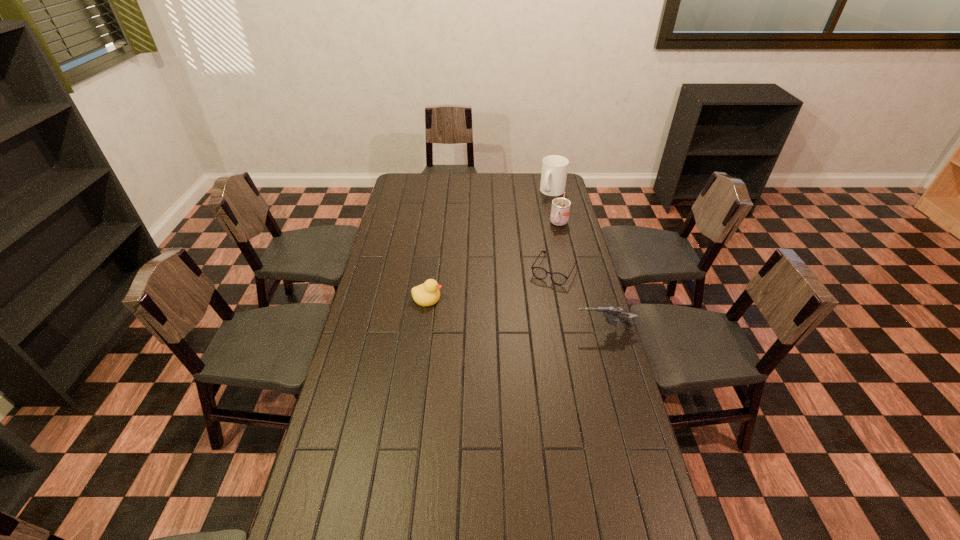
You are a GUI agent. You are given a task and a screenshot of the screen. Output one action in this format:
    pyautogui.click(x=<x>, y=<y>)
    Task: Click on the leftmost object
    Image resolution: width=960 pixels, height=540 pixels.
    Given the screenshot: What is the action you would take?
    pyautogui.click(x=427, y=294)

This screenshot has width=960, height=540. I want to click on duckling, so click(x=427, y=294).

This screenshot has width=960, height=540. Find the location of `gun`. gun is located at coordinates (x=610, y=313).

Where is `the third tallest object`? Image resolution: width=960 pixels, height=540 pixels. the third tallest object is located at coordinates (610, 313).

You are a GUI agent. You are given a task and a screenshot of the screen. Output one action in this format:
    pyautogui.click(x=<x>, y=<y>)
    Task: Click on the third farthest object
    
    Given the screenshot: What is the action you would take?
    pyautogui.click(x=540, y=273)

Where is `the shortest object`? The image size is (960, 540). the shortest object is located at coordinates (540, 273).

This screenshot has height=540, width=960. Identify the location of the second tallest object. (560, 209).

Locate an element on the screen. Image resolution: width=960 pixels, height=540 pixels. the fourth nearest object is located at coordinates (560, 209).

Identify the location of the farthest object. The height and width of the screenshot is (540, 960). (554, 167).

Locate an element on the screen. This screenshot has height=540, width=960. the tallest object is located at coordinates [554, 167].